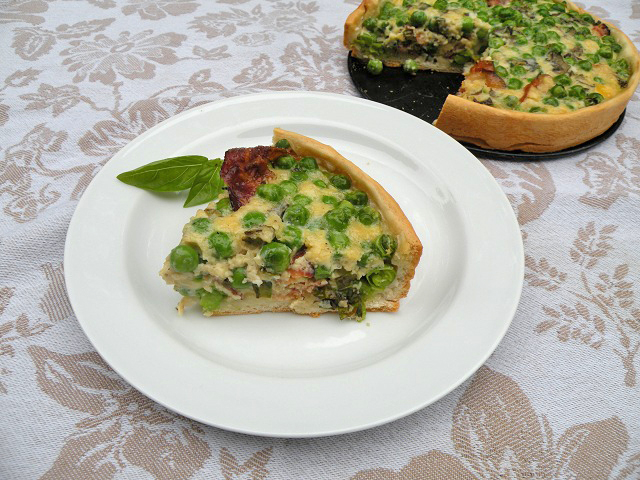
At what (x,y) coordinates should I click in order to perform the action: click on white plate. Please return your answer as a coordinate pair (x, y). Looking at the image, I should click on (422, 356).